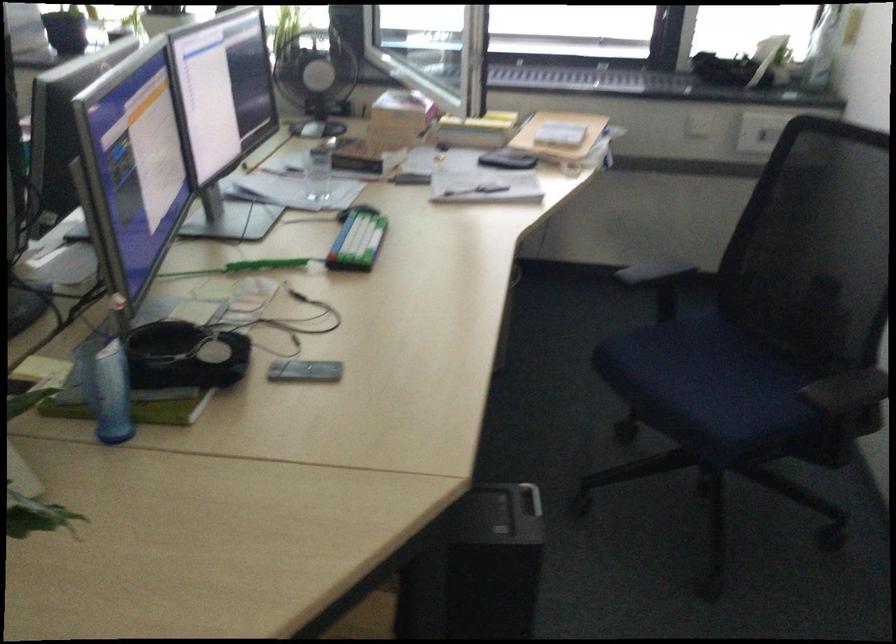
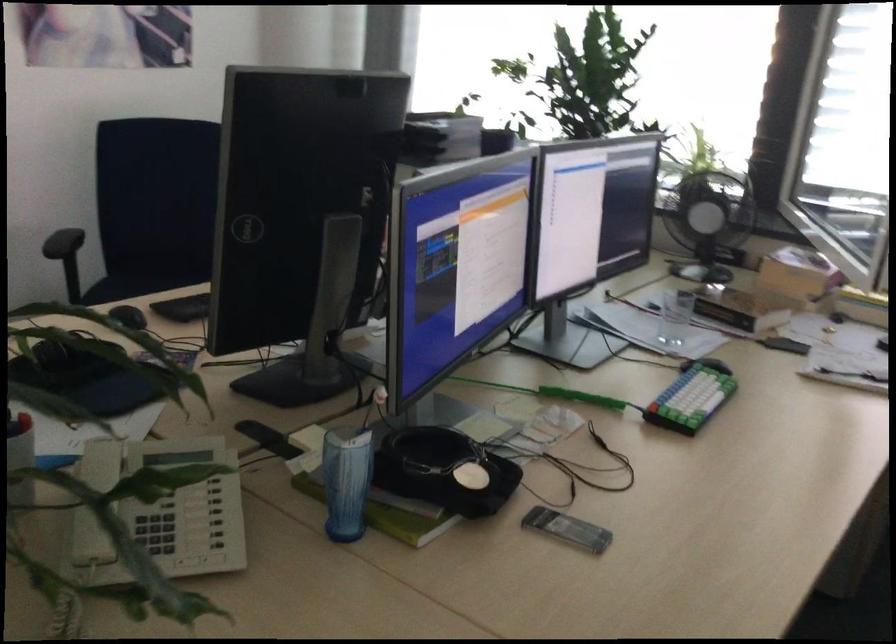
Question: The first image is from the beginning of the video and the second image is from the end. How did the camera likely rotate when shooting the video?

Choices:
 (A) Left
 (B) Right
 (C) Up
 (D) Down

Answer: (A)